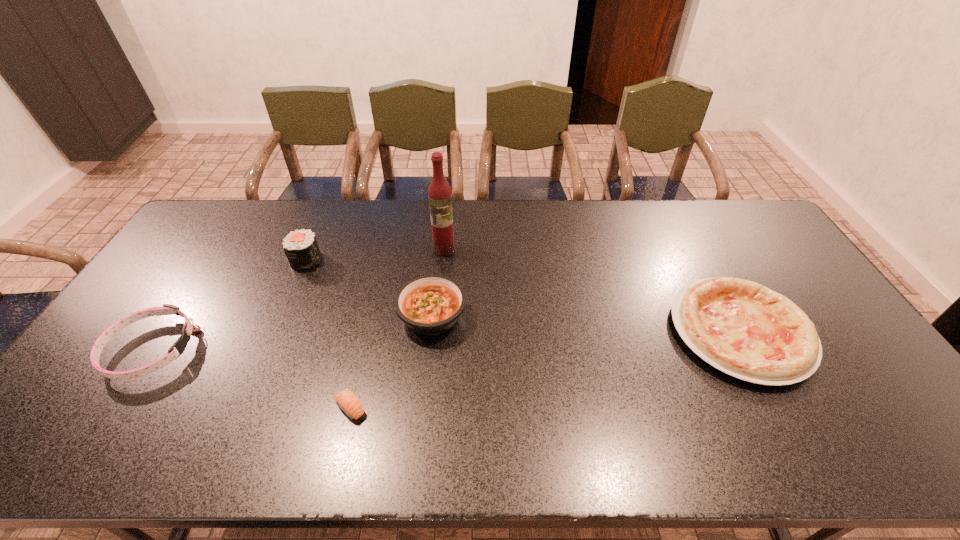
The width and height of the screenshot is (960, 540). Find the location of `vacant area situated on the front of the stew`. vacant area situated on the front of the stew is located at coordinates (420, 434).

This screenshot has height=540, width=960. I want to click on vacant space located on the right of the rightmost object, so click(836, 332).

Where is `free location located with the buckle on the leftmost object`? The height and width of the screenshot is (540, 960). free location located with the buckle on the leftmost object is located at coordinates (302, 349).

I want to click on free spot located 0.330m on the back of the nearest object, so click(x=375, y=298).

You are a GUI agent. You are given a task and a screenshot of the screen. Output one action in this format:
    pyautogui.click(x=<x>, y=<y>)
    Task: Click on the object at the left edge
    
    Given the screenshot: What is the action you would take?
    pyautogui.click(x=168, y=309)

At what (x,y) coordinates should I click in order to perform the action: click on object positioned at the right edge. Please return your answer as a coordinate pair (x, y). The width and height of the screenshot is (960, 540). Looking at the image, I should click on (744, 329).

Find the location of a particular element. This screenshot has height=540, width=960. vacant region at the far edge is located at coordinates (343, 203).

The image size is (960, 540). In the image, there is a desktop. Find the location of `blank space at the near edge`. blank space at the near edge is located at coordinates (717, 462).

You are a GUI agent. You are given a task and a screenshot of the screen. Output one action in this format:
    pyautogui.click(x=<x>, y=<y>)
    Task: Click on the blank space at the right edge of the desktop
    Image resolution: width=960 pixels, height=540 pixels.
    Given the screenshot: What is the action you would take?
    pyautogui.click(x=896, y=420)

In order to click on vacant point at the far left corner in this screenshot , I will do `click(218, 203)`.